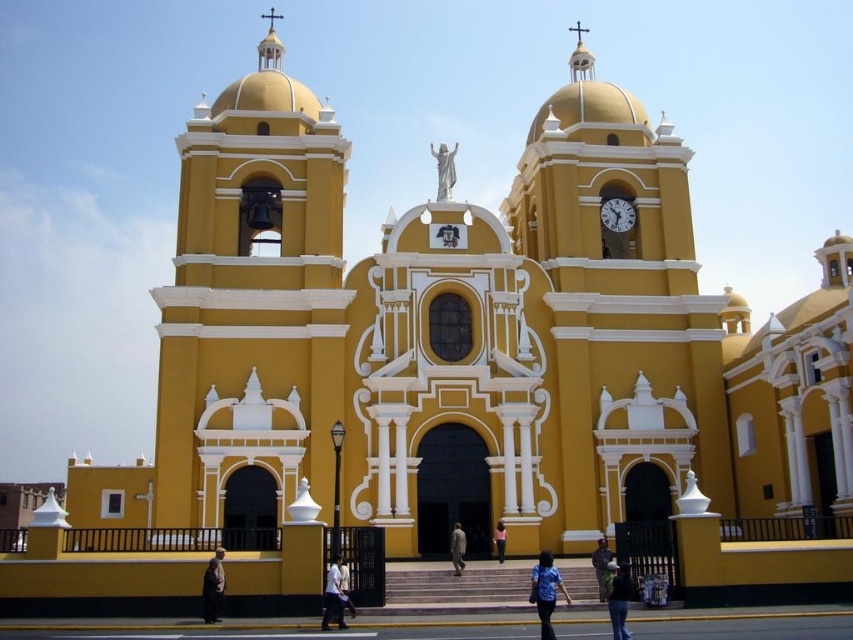
Question: Among these points, which one is farthest from the camera?

Choices:
 (A) (624, 628)
 (B) (451, 557)
 (C) (549, 600)

Answer: (B)

Question: Can you confirm if white matte shirt at center is positioned to the right of white cotton shirt at center?

Choices:
 (A) yes
 (B) no

Answer: (B)

Question: Which point is closer to the camera?

Choices:
 (A) dark green fabric jacket at center
 (B) white matte shirt at center
 (C) white marble statue at center

Answer: (A)

Question: Estimate the real-world distances between objects in this image. Which object is closer to the white cotton shirt at center?

Choices:
 (A) metallic clock face at upper right
 (B) dark blue fabric at center

Answer: (B)

Question: Can you confirm if dark green fabric jacket at center is positioned above pink fabric dress at center?

Choices:
 (A) yes
 (B) no

Answer: (B)

Question: Is blue fabric shirt at lower center wider than metallic clock face at upper right?

Choices:
 (A) yes
 (B) no

Answer: (A)